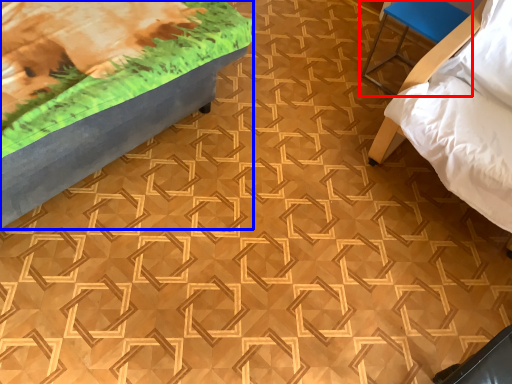
Question: Which object appears farthest to the camera in this image, furniture (highlighted by a red box) or furniture (highlighted by a blue box)?

Choices:
 (A) furniture
 (B) furniture

Answer: (A)